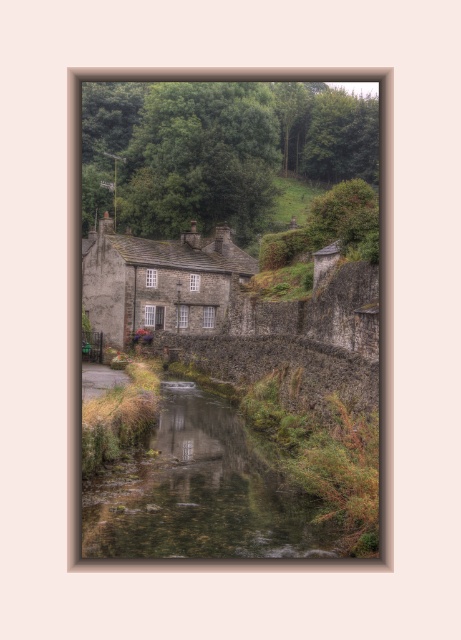
Question: Can you confirm if clear water stream at center is bigger than rustic stone cottage at center?

Choices:
 (A) yes
 (B) no

Answer: (B)

Question: Among these points, which one is nearest to the camera?

Choices:
 (A) (231, 472)
 (B) (226, 276)

Answer: (A)

Question: Does clear water stream at center have a lesser width compared to rustic stone cottage at center?

Choices:
 (A) no
 (B) yes

Answer: (B)

Question: Which point is closer to the camera taking this photo?

Choices:
 (A) (158, 266)
 (B) (140, 500)

Answer: (B)

Question: Is clear water stream at center wider than rustic stone cottage at center?

Choices:
 (A) yes
 (B) no

Answer: (B)